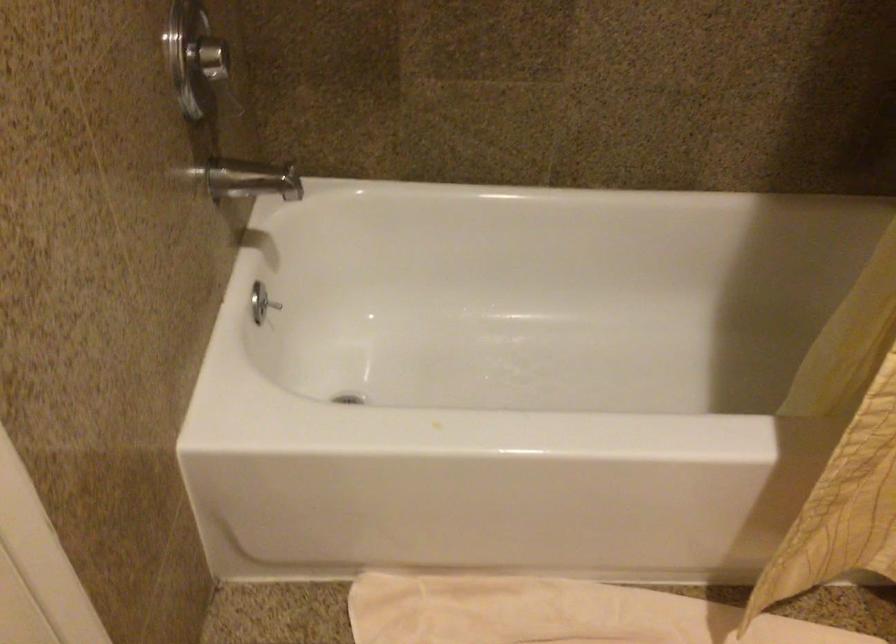
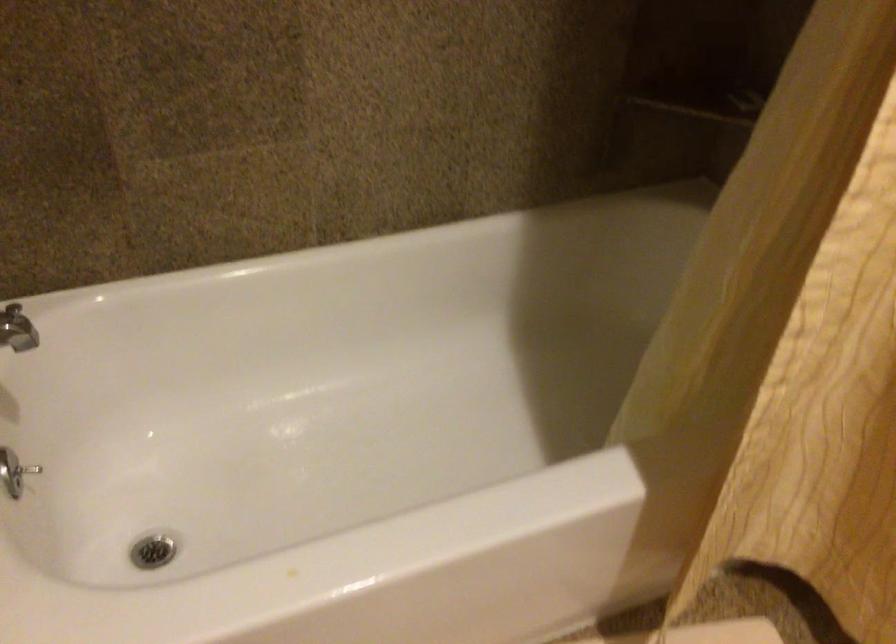
Question: The camera is either moving clockwise (left) or counter-clockwise (right) around the object. The first image is from the beginning of the video and the second image is from the end. Is the camera moving left or right when shooting the video?

Choices:
 (A) Left
 (B) Right

Answer: (A)